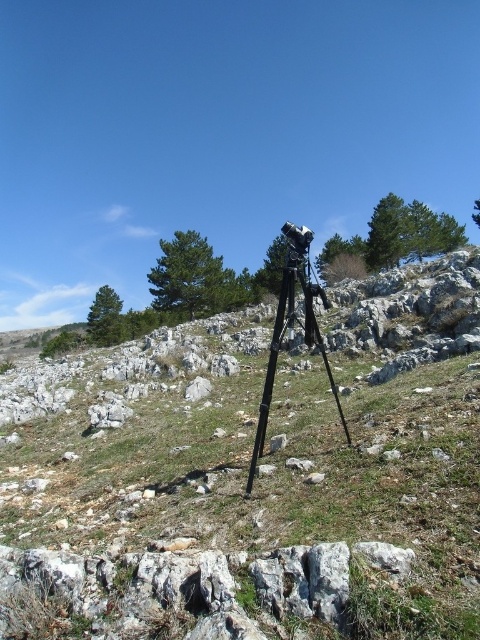
Is green grassy at center below black matte tripod at center?

Indeed, green grassy at center is positioned under black matte tripod at center.

Who is more forward, (149, 504) or (257, 445)?

Point (257, 445)

I want to click on green grassy at center, so click(250, 513).

In order to click on green grassy at center in this screenshot , I will do `click(250, 513)`.